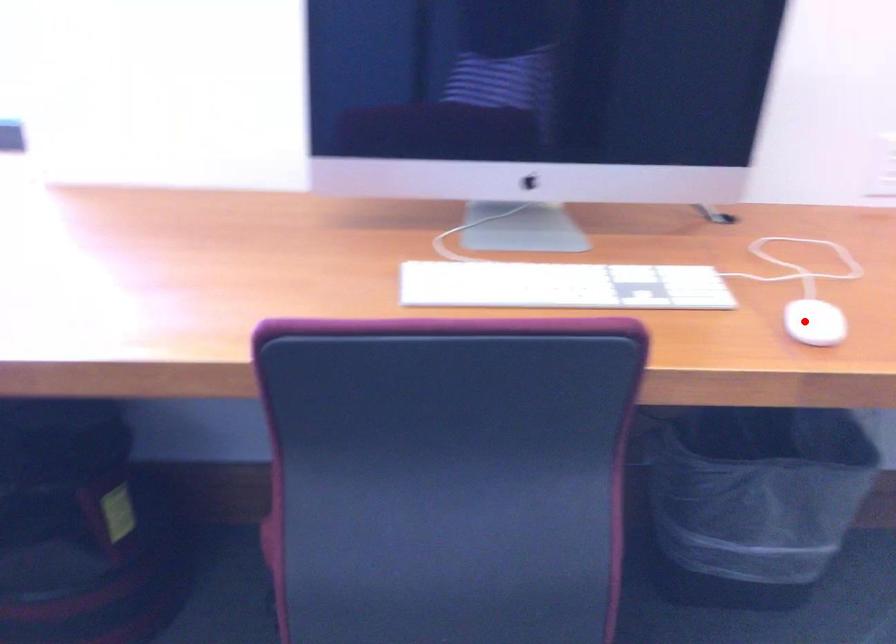
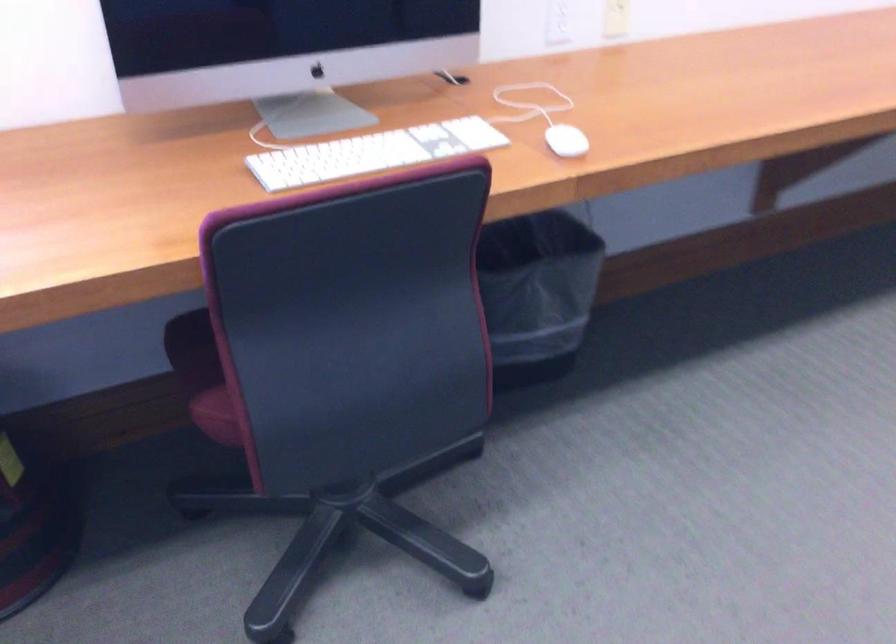
The point at the highlighted location is marked in the first image. Where is the corresponding point in the second image?

(565, 140)